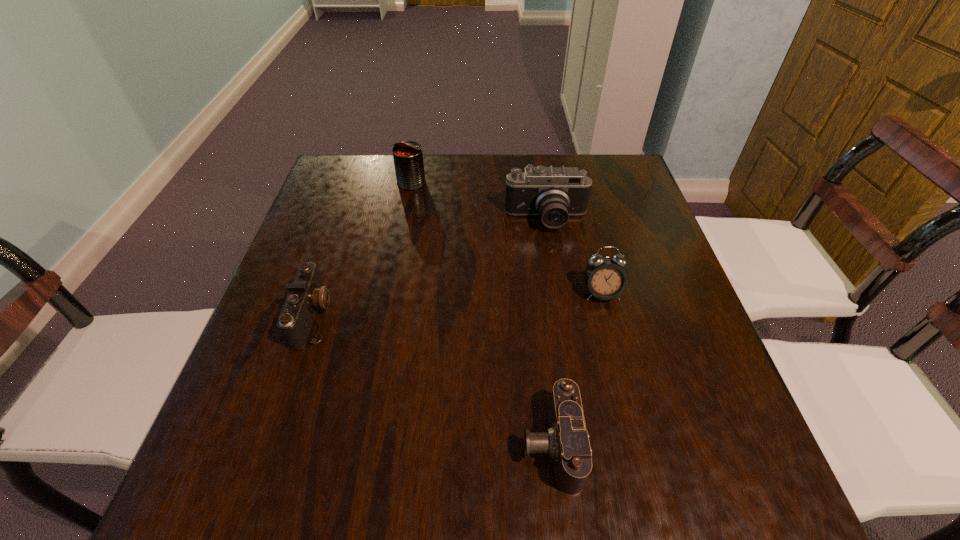
This screenshot has height=540, width=960. Identify the location of vacant space located on the face of the alarm clock. click(638, 438).

Where is `vacant area situated 0.300m on the front-facing side of the leftmost object`? Image resolution: width=960 pixels, height=540 pixels. vacant area situated 0.300m on the front-facing side of the leftmost object is located at coordinates (471, 316).

Identify the location of vacant space located 0.230m on the front-facing side of the nearest object. This screenshot has width=960, height=540. (387, 444).

Image resolution: width=960 pixels, height=540 pixels. I want to click on blank space located on the front-facing side of the nearest object, so click(x=387, y=444).

What are the coordinates of `vacant area situated 0.210m on the front-facing side of the nearest object` in the screenshot? It's located at (399, 444).

You are a GUI agent. You are given a task and a screenshot of the screen. Output one action in this format:
    pyautogui.click(x=<x>, y=<y>)
    Task: Click on the object at the far edge
    The height and width of the screenshot is (540, 960).
    Given the screenshot: What is the action you would take?
    pyautogui.click(x=408, y=156)

Find the location of a particular element. The height and width of the screenshot is (540, 960). object that is at the near edge is located at coordinates (566, 441).

At what (x,y) coordinates should I click in order to perform the action: click on object that is at the left edge. Please return your answer as a coordinate pair (x, y). The width and height of the screenshot is (960, 540). Looking at the image, I should click on (307, 293).

You are a GUI agent. You are given a task and a screenshot of the screen. Output one action in this format:
    pyautogui.click(x=<x>, y=<y>)
    Task: Click on the object that is at the right edge
    Image resolution: width=960 pixels, height=540 pixels.
    Given the screenshot: What is the action you would take?
    pyautogui.click(x=605, y=278)

Where is `vacant space at the far edge of the desktop`? This screenshot has width=960, height=540. vacant space at the far edge of the desktop is located at coordinates (543, 163).